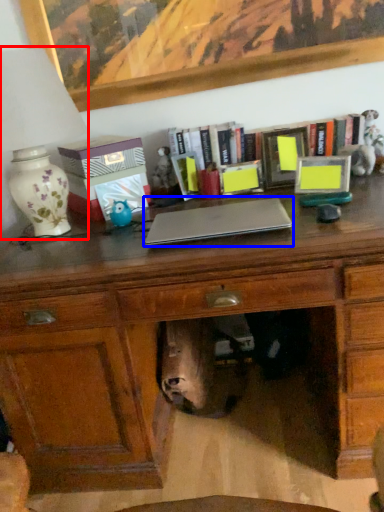
Question: Which object appears farthest to the camera in this image, table lamp (highlighted by a red box) or laptop (highlighted by a blue box)?

Choices:
 (A) table lamp
 (B) laptop

Answer: (B)